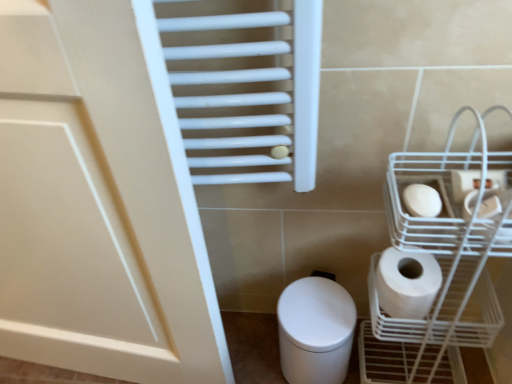
Locate an element on the screen. The height and width of the screenshot is (384, 512). white glossy bidet at lower center is located at coordinates (315, 330).

Describe the element at coordinates (407, 283) in the screenshot. I see `white matte toilet paper at lower right, the third toilet paper when ordered from top to bottom` at that location.

At what (x,y) coordinates should I click in order to perform the action: click on white glossy bidet at lower center. Please return your answer as a coordinate pair (x, y). Looking at the image, I should click on (315, 330).

Is there a large distance between white matte toilet paper at right, which is the 2th toilet paper from bottom to top, and white wire basket at lower right?

No, there isn't a large distance between white matte toilet paper at right, which is the 2th toilet paper from bottom to top, and white wire basket at lower right.

From the picture: Is white matte toilet paper at right, which is the 2th toilet paper from bottom to top, not within white wire basket at lower right?

That's incorrect, white matte toilet paper at right, which is the 2th toilet paper from bottom to top, is not completely outside white wire basket at lower right.

From the image's perspective, is white matte toilet paper at right, which is counted as the second toilet paper, starting from the top, on top of white wire basket at lower right?

Yes.

In terms of height, does white matte toilet paper at lower right, the third toilet paper when ordered from top to bottom, look taller or shorter compared to white wire basket at lower right?

In the image, white matte toilet paper at lower right, the third toilet paper when ordered from top to bottom, appears to be shorter than white wire basket at lower right.

Considering the sizes of objects white matte toilet paper at lower right, the first toilet paper in the bottom-to-top sequence, and white wire basket at lower right in the image provided, who is smaller, white matte toilet paper at lower right, the first toilet paper in the bottom-to-top sequence, or white wire basket at lower right?

With smaller size is white matte toilet paper at lower right, the first toilet paper in the bottom-to-top sequence.

Is white matte toilet paper at lower right, the third toilet paper when ordered from top to bottom, facing towards white wire basket at lower right?

Yes.

Which object is closer to the camera, white matte toilet paper at right, which is counted as the second toilet paper, starting from the top, or white glossy bidet at lower center?

white matte toilet paper at right, which is counted as the second toilet paper, starting from the top.

From the image's perspective, which is above, white matte toilet paper at right, which is the 2th toilet paper from bottom to top, or white glossy bidet at lower center?

white matte toilet paper at right, which is the 2th toilet paper from bottom to top, appears higher in the image.

Is white glossy bidet at lower center at the back of white matte toilet paper at right, which is the 2th toilet paper from bottom to top?

white matte toilet paper at right, which is the 2th toilet paper from bottom to top, is not turned away from white glossy bidet at lower center.

Which is closer to the camera, (416,192) or (297,337)?

Clearly, point (416,192) is closer to the camera than point (297,337).

Is the surface of white glossy bidet at lower center in direct contact with white wire basket at lower right?

white glossy bidet at lower center and white wire basket at lower right are clearly separated.

I want to click on basket on the right of white glossy bidet at lower center, so click(450, 243).

Can we say white glossy bidet at lower center lies outside white wire basket at lower right?

Yes, white glossy bidet at lower center is not within white wire basket at lower right.

From the image's perspective, does white glossy bidet at lower center appear higher than white wire basket at lower right?

No.

From the image's perspective, is white matte toilet paper at right, which is counted as the second toilet paper, starting from the top, below white matte toilet paper at lower right, the first toilet paper in the bottom-to-top sequence?

No, from the image's perspective, white matte toilet paper at right, which is counted as the second toilet paper, starting from the top, is not beneath white matte toilet paper at lower right, the first toilet paper in the bottom-to-top sequence.

You are a GUI agent. You are given a task and a screenshot of the screen. Output one action in this format:
    pyautogui.click(x=<x>, y=<y>)
    Task: Click on the toilet paper on the left of white matte toilet paper at lower right, the first toilet paper in the bottom-to-top sequence
    This screenshot has height=384, width=512.
    Given the screenshot: What is the action you would take?
    pyautogui.click(x=422, y=200)

Is white matte toilet paper at right, which is counted as the second toilet paper, starting from the top, aimed at white matte toilet paper at lower right, the third toilet paper when ordered from top to bottom?

No, white matte toilet paper at right, which is counted as the second toilet paper, starting from the top, is not facing towards white matte toilet paper at lower right, the third toilet paper when ordered from top to bottom.

Considering the relative sizes of white glossy bidet at lower center and white matte toilet paper at lower right, the third toilet paper when ordered from top to bottom, in the image provided, is white glossy bidet at lower center shorter than white matte toilet paper at lower right, the third toilet paper when ordered from top to bottom,?

In fact, white glossy bidet at lower center may be taller than white matte toilet paper at lower right, the third toilet paper when ordered from top to bottom.

Considering the positions of point (291, 339) and point (417, 309), is point (291, 339) closer or farther from the camera than point (417, 309)?

Point (291, 339).

How different are the orientations of white glossy bidet at lower center and white matte toilet paper at lower right, the third toilet paper when ordered from top to bottom, in degrees?

The facing directions of white glossy bidet at lower center and white matte toilet paper at lower right, the third toilet paper when ordered from top to bottom, are 0.517 degrees apart.

From the image's perspective, between white glossy bidet at lower center and white matte toilet paper at lower right, the first toilet paper in the bottom-to-top sequence, who is located below?

white glossy bidet at lower center.

From their relative heights in the image, would you say white wire basket at lower right is taller or shorter than white glossy bidet at lower center?

white wire basket at lower right is taller than white glossy bidet at lower center.

Find the location of `basket located in front of the white glossy bidet at lower center`. basket located in front of the white glossy bidet at lower center is located at coordinates (450, 243).

How different are the orientations of white wire basket at lower right and white glossy bidet at lower center in degrees?

0.517 degrees separate the facing orientations of white wire basket at lower right and white glossy bidet at lower center.

Does white wire basket at lower right lie behind white glossy bidet at lower center?

No, it is not.

Locate an element on the screen. This screenshot has width=512, height=384. basket that is in front of the white matte toilet paper at right, which is the 2th toilet paper from bottom to top is located at coordinates (450, 243).

Where is `the 1st toilet paper to the left when counting from the white wire basket at lower right`? Image resolution: width=512 pixels, height=384 pixels. the 1st toilet paper to the left when counting from the white wire basket at lower right is located at coordinates (407, 283).

Based on their spatial positions, is white matte toilet paper at right, which is the 2th toilet paper from bottom to top, or white matte toilet paper at lower right, the first toilet paper in the bottom-to-top sequence, further from white wire basket at lower right?

The object further to white wire basket at lower right is white matte toilet paper at right, which is the 2th toilet paper from bottom to top.

When comparing their distances from white wire basket at lower right, does white glossy bidet at lower center or white matte toilet paper at right, which is counted as the second toilet paper, starting from the top, seem further?

→ white glossy bidet at lower center is further to white wire basket at lower right.

From the image, which object appears to be farther from white matte toilet paper at lower right, the first toilet paper in the bottom-to-top sequence, white wire basket at lower right or white matte toilet paper at right, which is the 2th toilet paper from bottom to top?

white matte toilet paper at right, which is the 2th toilet paper from bottom to top, is further to white matte toilet paper at lower right, the first toilet paper in the bottom-to-top sequence.

From the image, which object appears to be farther from white matte toilet paper at lower right, the first toilet paper in the bottom-to-top sequence, white glossy bidet at lower center or white wire basket at lower right?

The object further to white matte toilet paper at lower right, the first toilet paper in the bottom-to-top sequence, is white glossy bidet at lower center.

From the image, which object appears to be farther from white matte toilet paper at right, which is the 2th toilet paper from bottom to top, white glossy bidet at lower center or white matte toilet paper at lower right, the first toilet paper in the bottom-to-top sequence?

white glossy bidet at lower center.

Estimate the real-world distances between objects in this image. Which object is closer to white wire basket at lower right, white glossy bidet at lower center or white matte toilet paper at right, which is the 1th toilet paper in top-to-bottom order?

Based on the image, white matte toilet paper at right, which is the 1th toilet paper in top-to-bottom order, appears to be nearer to white wire basket at lower right.

From the image, which object appears to be nearer to white matte toilet paper at right, which is the 1th toilet paper in top-to-bottom order, white matte toilet paper at right, which is the 2th toilet paper from bottom to top, or white glossy bidet at lower center?

Answer: white matte toilet paper at right, which is the 2th toilet paper from bottom to top.

Estimate the real-world distances between objects in this image. Which object is closer to white matte toilet paper at lower right, the first toilet paper in the bottom-to-top sequence, white matte toilet paper at right, which is the 2th toilet paper from bottom to top, or white wire basket at lower right?

Among the two, white wire basket at lower right is located nearer to white matte toilet paper at lower right, the first toilet paper in the bottom-to-top sequence.

Identify the location of basket between white matte toilet paper at right, which is counted as the second toilet paper, starting from the top, and white glossy bidet at lower center from top to bottom. This screenshot has width=512, height=384. (450, 243).

This screenshot has height=384, width=512. I want to click on basket between white matte toilet paper at right, which is the 1th toilet paper in top-to-bottom order, and white glossy bidet at lower center in the up-down direction, so click(450, 243).

The height and width of the screenshot is (384, 512). Find the location of `toilet paper between white matte toilet paper at right, placed as the 3th toilet paper when sorted from bottom to top, and white matte toilet paper at lower right, the first toilet paper in the bottom-to-top sequence, from top to bottom`. toilet paper between white matte toilet paper at right, placed as the 3th toilet paper when sorted from bottom to top, and white matte toilet paper at lower right, the first toilet paper in the bottom-to-top sequence, from top to bottom is located at coordinates tap(422, 200).

The width and height of the screenshot is (512, 384). Identify the location of toilet paper between white wire basket at lower right and white matte toilet paper at right, placed as the 3th toilet paper when sorted from bottom to top, along the z-axis. (422, 200).